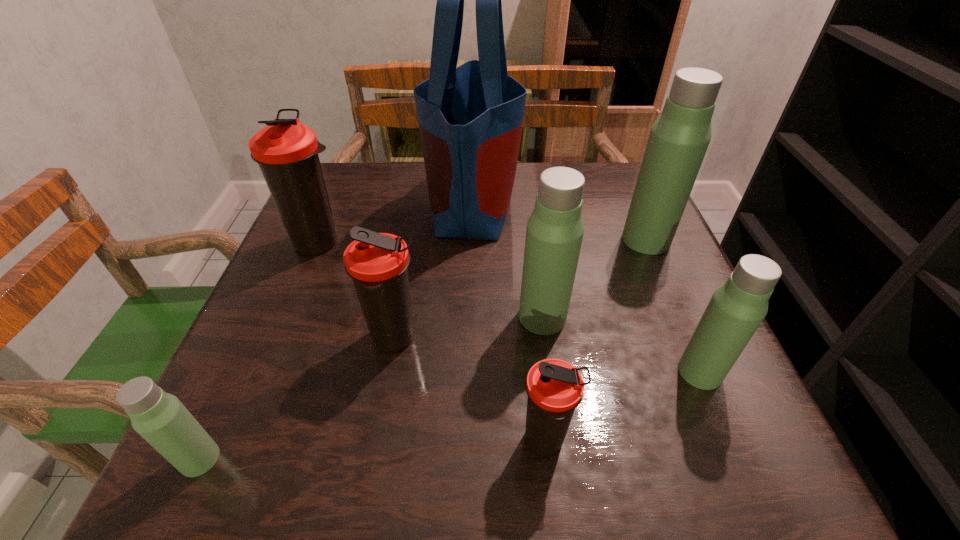
This screenshot has width=960, height=540. What are the coordinates of `free space located 0.240m on the left of the second smallest light thermos bottle` in the screenshot? It's located at (536, 372).

Find the location of a particular element. This screenshot has width=960, height=540. vacant space situated on the right of the rightmost brown thermos bottle is located at coordinates (708, 441).

Image resolution: width=960 pixels, height=540 pixels. I want to click on vacant area situated on the right of the leftmost light thermos bottle, so click(x=476, y=459).

Find the location of a particular element. object that is at the far edge is located at coordinates (470, 118).

Where is `object present at the near left corner`? object present at the near left corner is located at coordinates [160, 418].

What are the coordinates of `vacant space at the far edge of the desktop` in the screenshot? It's located at (514, 208).

Find the location of `free space at the near edge`. free space at the near edge is located at coordinates (641, 457).

The image size is (960, 540). What are the coordinates of `free space at the left edge of the desktop` in the screenshot? It's located at (300, 262).

Where is `vacant space at the right edge`? vacant space at the right edge is located at coordinates (649, 368).

Identify the location of vacant space at the far left corner of the desktop. Image resolution: width=960 pixels, height=540 pixels. (349, 162).